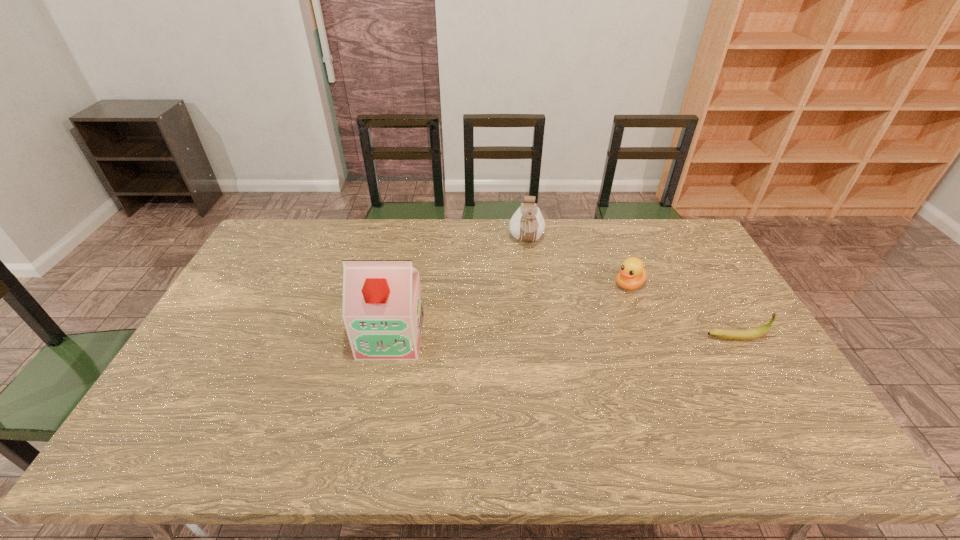
The width and height of the screenshot is (960, 540). In order to click on the leftmost object in this screenshot , I will do `click(383, 313)`.

Identify the location of soya milk. This screenshot has height=540, width=960. tap(383, 313).

The image size is (960, 540). In order to click on banana in this screenshot , I will do `click(739, 335)`.

Locate an element on the screen. The height and width of the screenshot is (540, 960). the second object from right to left is located at coordinates (632, 275).

The width and height of the screenshot is (960, 540). What are the coordinates of `duckling` in the screenshot? It's located at (632, 275).

This screenshot has width=960, height=540. I want to click on the third object from right to left, so click(527, 224).

The height and width of the screenshot is (540, 960). What are the coordinates of `pouch` in the screenshot? It's located at (527, 224).

Locate an element on the screen. The image size is (960, 540). vacant space located 0.130m with the cap open on the tallest object is located at coordinates coord(378,402).

The height and width of the screenshot is (540, 960). I want to click on vacant point located 0.150m on the face of the third nearest object, so click(590, 313).

The height and width of the screenshot is (540, 960). Find the location of `free space located 0.310m on the face of the third nearest object`. free space located 0.310m on the face of the third nearest object is located at coordinates (555, 340).